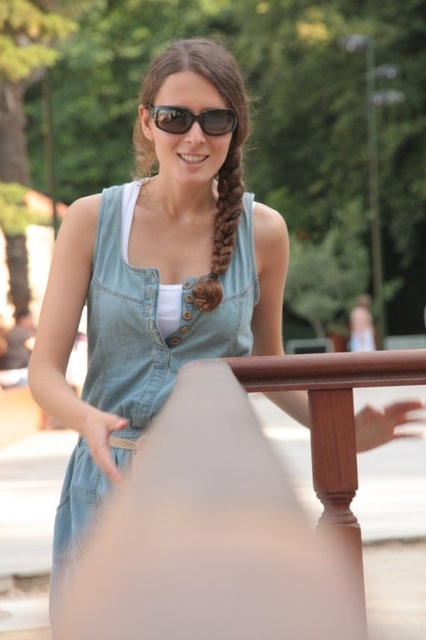
Question: Does matte denim dress at center have a smaller size compared to brown silky hair braid at center?

Choices:
 (A) yes
 (B) no

Answer: (B)

Question: Where is denim dress at center located in relation to matte black sunglasses at center in the image?

Choices:
 (A) left
 (B) right

Answer: (A)

Question: Which point is farther to the camera?

Choices:
 (A) brown silky hair braid at center
 (B) matte black sunglasses at center
 (C) denim dress at center

Answer: (A)

Question: Considering the real-world distances, which object is closest to the denim dress at center?

Choices:
 (A) matte denim dress at center
 (B) brown silky hair braid at center

Answer: (B)

Question: Based on their relative distances, which object is nearer to the denim dress at center?

Choices:
 (A) brown silky hair braid at center
 (B) matte black sunglasses at center
 (C) matte denim dress at center

Answer: (A)

Question: Can you confirm if matte denim dress at center is wider than brown silky hair braid at center?

Choices:
 (A) no
 (B) yes

Answer: (B)